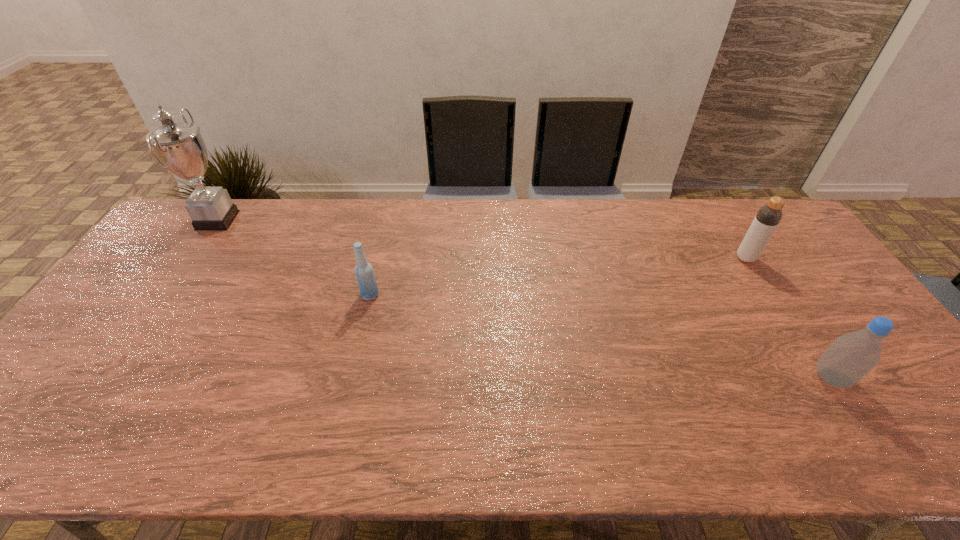
Where is `bottle identified as the closest to the nearest object`? The image size is (960, 540). bottle identified as the closest to the nearest object is located at coordinates (768, 217).

Point out which bottle is positioned as the nearest to the second nearest object. Please provide its 2D coordinates. Your answer should be formatted as a tuple, i.e. [(x, y)], where the tuple contains the x and y coordinates of a point satisfying the conditions above.

[(768, 217)]

At what (x,y) coordinates should I click in order to perform the action: click on vacant area that satisfies the following two spatial constraints: 1. at the front view of the second farthest object; 2. on the right side of the tallest object. Please return your answer as a coordinate pair (x, y). This screenshot has width=960, height=540. Looking at the image, I should click on (191, 258).

At what (x,y) coordinates should I click in order to perform the action: click on blank area in the image that satisfies the following two spatial constraints: 1. at the front view of the leftmost object; 2. on the left side of the nearest object. Please return your answer as a coordinate pair (x, y). The width and height of the screenshot is (960, 540). Looking at the image, I should click on (110, 377).

Identify the location of blank space that satisfies the following two spatial constraints: 1. at the front view of the leftmost bottle; 2. on the left side of the trophy cup. (166, 295).

What are the coordinates of `vacant space that satisfies the following two spatial constraints: 1. at the front view of the nearest bottle; 2. on the left side of the tallest object` in the screenshot? It's located at (110, 377).

Identify the location of vacant area in the image that satisfies the following two spatial constraints: 1. at the front view of the trophy cup; 2. on the back side of the nearest bottle. (110, 377).

What are the coordinates of `vacant area that satisfies the following two spatial constraints: 1. at the front view of the leftmost object; 2. on the back side of the nearest bottle` in the screenshot? It's located at (110, 377).

The width and height of the screenshot is (960, 540). I want to click on free spot that satisfies the following two spatial constraints: 1. at the front view of the farthest object; 2. on the back side of the second farthest bottle, so click(166, 295).

Identify the location of free spot that satisfies the following two spatial constraints: 1. at the front view of the tallest object; 2. on the right side of the nearest bottle. This screenshot has height=540, width=960. (110, 377).